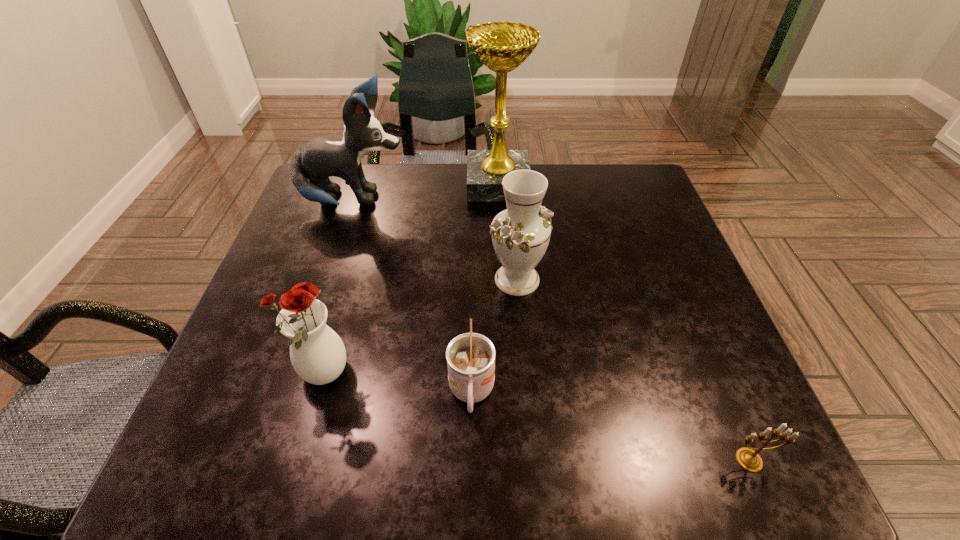
Where is `free space that satisfies the following two spatial constraints: 1. on the front-facing side of the rightmost object; 2. on the right side of the award`? free space that satisfies the following two spatial constraints: 1. on the front-facing side of the rightmost object; 2. on the right side of the award is located at coordinates 512,460.